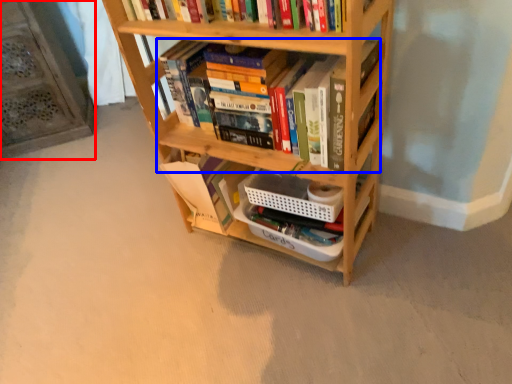
Question: Which point is further to the camera, shelf (highlighted by a red box) or book (highlighted by a blue box)?

Choices:
 (A) shelf
 (B) book

Answer: (A)